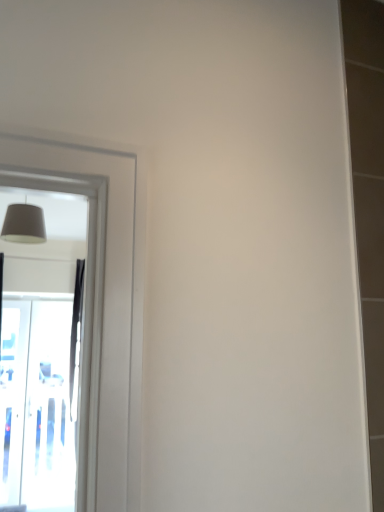
Image resolution: width=384 pixels, height=512 pixels. What do you see at coordinates (24, 224) in the screenshot? I see `matte gray lampshade at upper left` at bounding box center [24, 224].

You are a GUI agent. You are given a task and a screenshot of the screen. Output one action in this format:
    pyautogui.click(x=<x>, y=<y>)
    Task: Click on the matte gray lampshade at upper left
    
    Given the screenshot: What is the action you would take?
    pyautogui.click(x=24, y=224)

What is the approximate height of transparent glass screen door at left?

transparent glass screen door at left is 6.20 feet tall.

Measure the distance between transparent glass screen door at left and camera.

transparent glass screen door at left is 12.68 feet from camera.

The image size is (384, 512). What do you see at coordinates (36, 406) in the screenshot?
I see `transparent glass screen door at left` at bounding box center [36, 406].

The height and width of the screenshot is (512, 384). Find the location of `transparent glass screen door at left`. transparent glass screen door at left is located at coordinates (36, 406).

At what (x,y) coordinates should I click in order to perform the action: click on matte gray lampshade at upper left. Please return your answer as a coordinate pair (x, y). The width and height of the screenshot is (384, 512). Looking at the image, I should click on (24, 224).

In the scene shown: Which object is positioned more to the left, matte gray lampshade at upper left or transparent glass screen door at left?

Positioned to the left is transparent glass screen door at left.

Which object is closer to the camera, matte gray lampshade at upper left or transparent glass screen door at left?

matte gray lampshade at upper left is more forward.

Considering the positions of point (13, 227) and point (30, 463), is point (13, 227) closer or farther from the camera than point (30, 463)?

Point (13, 227).

From the image's perspective, relative to transparent glass screen door at left, is matte gray lampshade at upper left above or below?

matte gray lampshade at upper left is above transparent glass screen door at left.

In the scene shown: From a real-world perspective, which is physically above, matte gray lampshade at upper left or transparent glass screen door at left?

matte gray lampshade at upper left.

Is matte gray lampshade at upper left thinner than transparent glass screen door at left?

Incorrect, the width of matte gray lampshade at upper left is not less than that of transparent glass screen door at left.

From the picture: Is matte gray lampshade at upper left taller than transparent glass screen door at left?

Incorrect, the height of matte gray lampshade at upper left is not larger of that of transparent glass screen door at left.

Based on their sizes in the image, would you say matte gray lampshade at upper left is bigger or smaller than transparent glass screen door at left?

matte gray lampshade at upper left is smaller than transparent glass screen door at left.

Is matte gray lampshade at upper left inside or outside of transparent glass screen door at left?

matte gray lampshade at upper left is not enclosed by transparent glass screen door at left.

From the picture: Is matte gray lampshade at upper left next to transparent glass screen door at left?

They are not placed beside each other.

Is matte gray lampshade at upper left turned away from transparent glass screen door at left?

No, transparent glass screen door at left is not at the back of matte gray lampshade at upper left.

You are a GUI agent. You are given a task and a screenshot of the screen. Output one action in this format:
    pyautogui.click(x=<x>, y=<y>)
    Task: Click on the lamp that appears on the right of transparent glass screen door at left
    Image resolution: width=384 pixels, height=512 pixels.
    Given the screenshot: What is the action you would take?
    pyautogui.click(x=24, y=224)

Which object is positioned more to the right, transparent glass screen door at left or matte gray lampshade at upper left?

matte gray lampshade at upper left is more to the right.

Considering the positions of objects transparent glass screen door at left and matte gray lampshade at upper left in the image provided, who is in front, transparent glass screen door at left or matte gray lampshade at upper left?

matte gray lampshade at upper left is in front.

Is point (13, 480) positioned before point (26, 234)?

No.

From the image's perspective, which object appears higher, transparent glass screen door at left or matte gray lampshade at upper left?

matte gray lampshade at upper left appears higher in the image.

From a real-world perspective, does transparent glass screen door at left sit lower than matte gray lampshade at upper left?

Correct, in the physical world, transparent glass screen door at left is lower than matte gray lampshade at upper left.

Can you confirm if transparent glass screen door at left is wider than matte gray lampshade at upper left?

In fact, transparent glass screen door at left might be narrower than matte gray lampshade at upper left.

Based on the photo, considering the relative sizes of transparent glass screen door at left and matte gray lampshade at upper left in the image provided, is transparent glass screen door at left taller than matte gray lampshade at upper left?

Correct, transparent glass screen door at left is much taller as matte gray lampshade at upper left.

Who is bigger, transparent glass screen door at left or matte gray lampshade at upper left?

With larger size is transparent glass screen door at left.

Could matte gray lampshade at upper left be considered to be inside transparent glass screen door at left?

No, transparent glass screen door at left does not contain matte gray lampshade at upper left.

Are transparent glass screen door at left and matte gray lampshade at upper left located far from each other?

Indeed, transparent glass screen door at left is not near matte gray lampshade at upper left.

Could you tell me if transparent glass screen door at left is turned towards matte gray lampshade at upper left?

Yes.

The height and width of the screenshot is (512, 384). I want to click on lamp located in front of the transparent glass screen door at left, so click(x=24, y=224).

Identify the location of screen door that is behind the matte gray lampshade at upper left. The height and width of the screenshot is (512, 384). (36, 406).

Find the location of `screen door lying below the matte gray lampshade at upper left (from the image's perspective)`. screen door lying below the matte gray lampshade at upper left (from the image's perspective) is located at coordinates (36, 406).